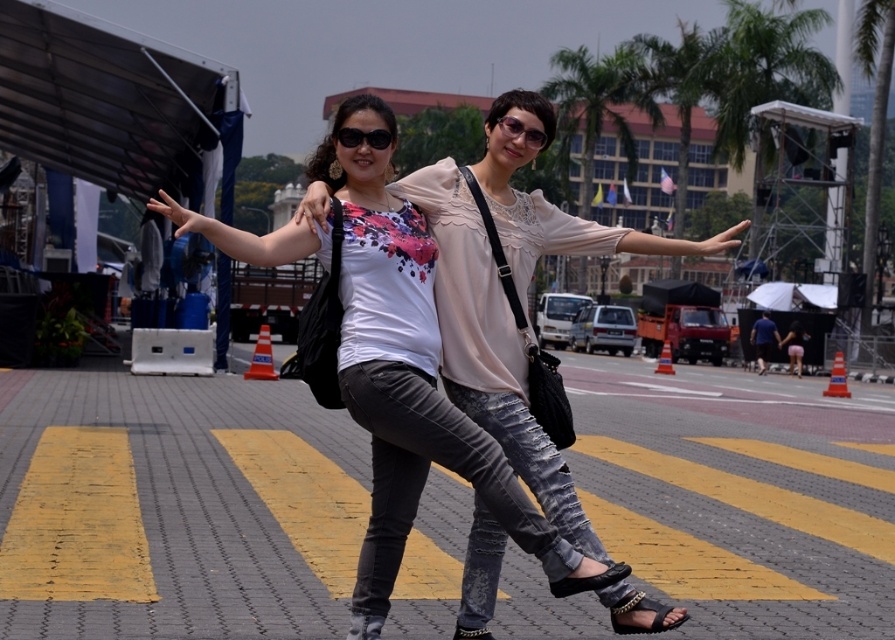
You are standing at the point marked by the coordinates point (x=175, y=506) in the image. Looking around, what material are you standing on?

The point (x=175, y=506) indicates gray brick pavement at center, so you are standing on gray brick pavement.

You are a photographer trying to adjust the focus on your camera. You notice two black items in the scene, the matte black top at center and the matte black sunglasses at upper center. Which of these two items is closer to the camera?

The matte black top at center is closer to the camera because it is 4.39 feet away from the matte black sunglasses at upper center, meaning the top is nearer to the camera than the sunglasses.

You are standing at the edge of the scene and want to walk towards the gray brick pavement at center and the matte black top at center. Which object will you encounter first?

The matte black top at center will be encountered first because it is positioned to the left of the gray brick pavement at center, making it closer to your starting point at the edge of the scene.